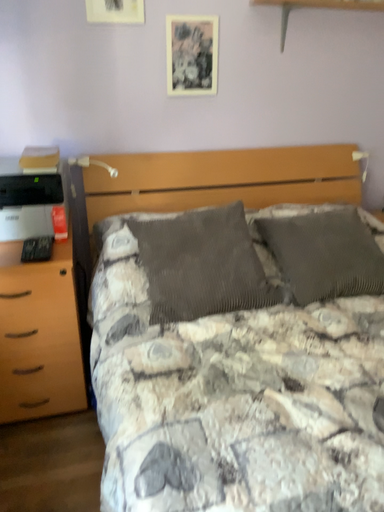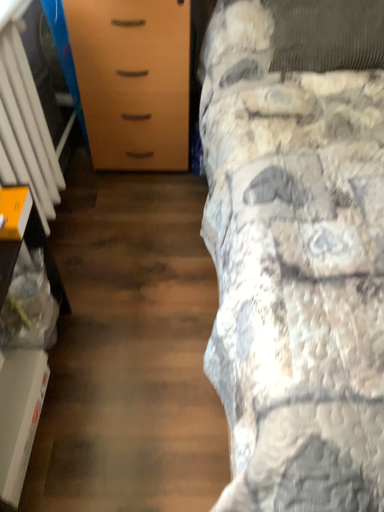
Question: Which way did the camera rotate in the video?

Choices:
 (A) rotated right
 (B) rotated left

Answer: (B)